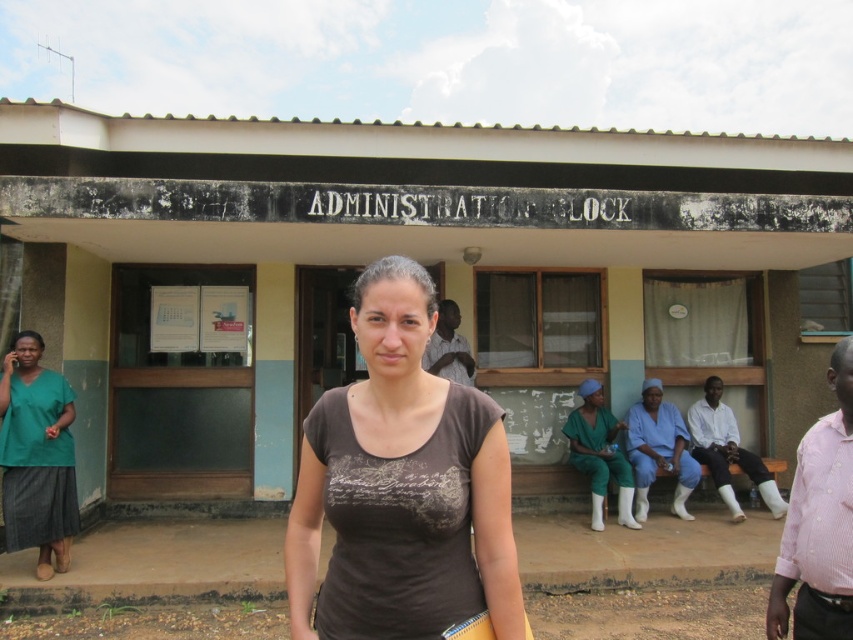
Question: Does brown cotton shirt at center appear on the left side of blue scrubs at center?

Choices:
 (A) yes
 (B) no

Answer: (A)

Question: Estimate the real-world distances between objects in this image. Which object is farther from the pink checkered shirt at right?

Choices:
 (A) matte green scrubs at center
 (B) gray fabric shirt at center
 (C) white cotton socks at lower right

Answer: (C)

Question: Can you confirm if green fabric shirt at left is bigger than white cotton socks at lower right?

Choices:
 (A) no
 (B) yes

Answer: (A)

Question: Which object is farther from the camera taking this photo?

Choices:
 (A) green fabric shirt at left
 (B) blue scrubs at center
 (C) white cotton socks at lower right
 (D) matte green scrubs at center

Answer: (C)

Question: Considering the real-world distances, which object is farthest from the brown cotton shirt at center?

Choices:
 (A) green fabric shirt at left
 (B) matte green scrubs at center
 (C) white cotton socks at lower right

Answer: (C)

Question: Is green fabric shirt at left bigger than matte green scrubs at center?

Choices:
 (A) no
 (B) yes

Answer: (A)